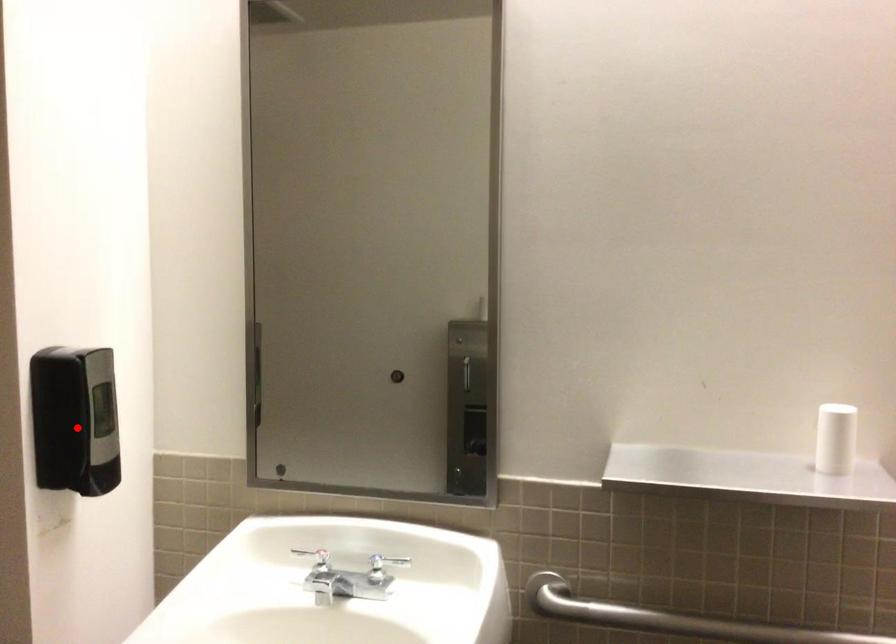
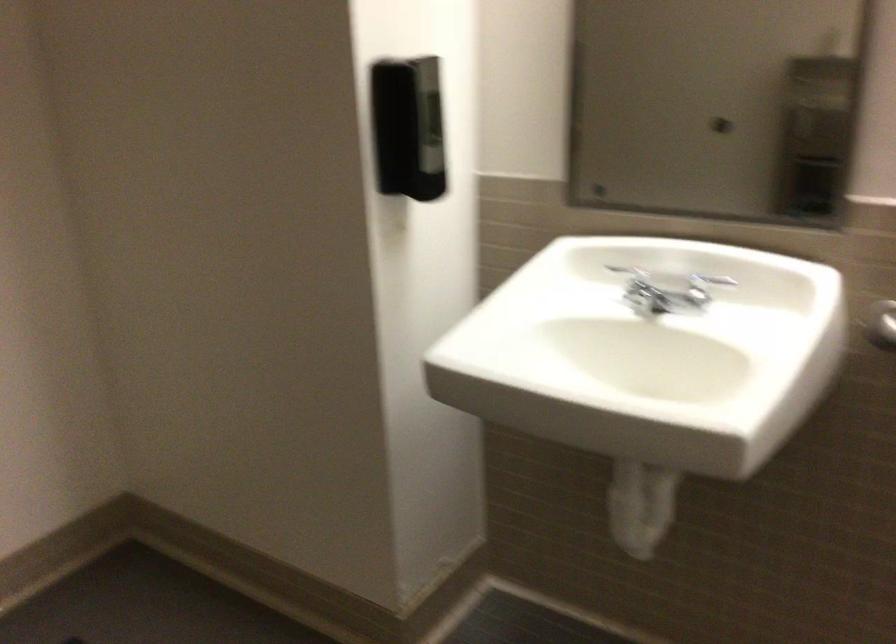
Find the pixel in the second image that matches the highlighted location in the first image.

(408, 128)